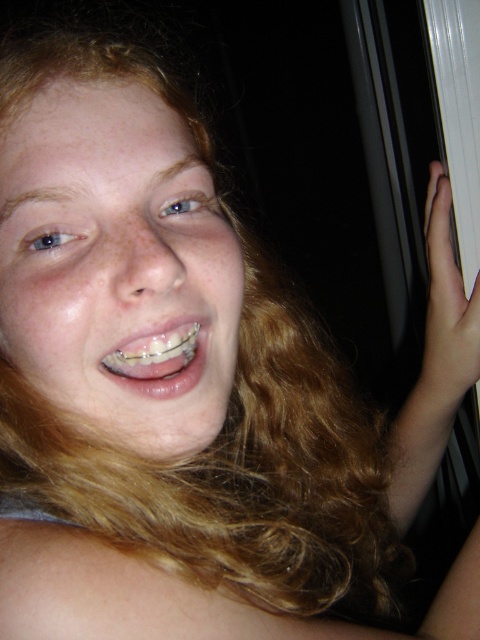
You are a dental technician who needs to measure the distance between the white matte hand at upper right and the clear plastic braces at center in the image. According to the scene, is the distance sufficient to fit a standard ruler? Explain your answer.

The distance between the white matte hand at upper right and the clear plastic braces at center is 33.30 centimeters. A standard ruler is typically 30 centimeters long. Since 33.30 cm is longer than 30 cm, the ruler would not be long enough to fully measure the distance between the white matte hand at upper right and the clear plastic braces at center.

Based on the scene, if you were to draw an imaginary vertical line from the white matte hand at upper right downward, would it intersect with the clear plastic braces at center?

Yes, the white matte hand at upper right is above the clear plastic braces at center, so a vertical line drawn downward from the hand would intersect with the braces.

In the scene shown: You are a photographer adjusting lighting for a portrait. You notice the white matte hand at upper right and clear plastic braces at center in the frame. Which object should you focus on to ensure the braces are clearly visible without the hand obstructing them?

The clear plastic braces at center is behind the white matte hand at upper right. To ensure the braces are clearly visible, focus on adjusting the lighting or repositioning the subject so the hand is moved away from the braces at center.